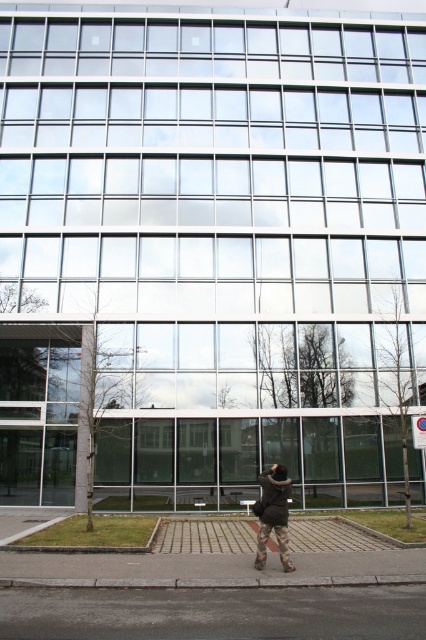
Is gray asphalt at lower center smaller than gray concrete curb at lower center?

No.

Image resolution: width=426 pixels, height=640 pixels. Describe the element at coordinates (215, 612) in the screenshot. I see `gray asphalt at lower center` at that location.

Between point (360, 628) and point (115, 582), which one is positioned in front?

Point (360, 628) is in front.

Where is `gray asphalt at lower center`? The width and height of the screenshot is (426, 640). gray asphalt at lower center is located at coordinates (215, 612).